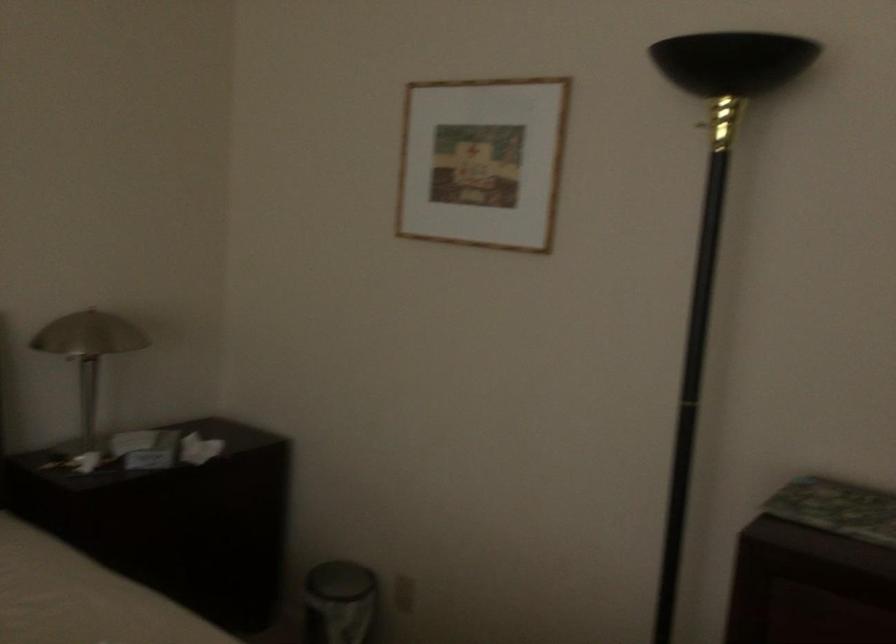
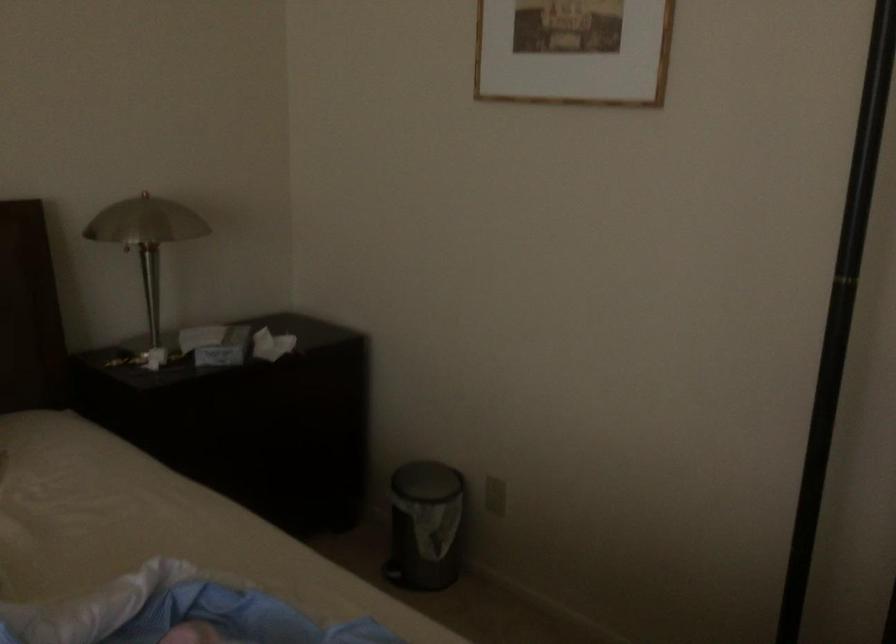
Question: What movement of the cameraman would produce the second image?

Choices:
 (A) Left
 (B) Right
 (C) Forward
 (D) Backward

Answer: (C)